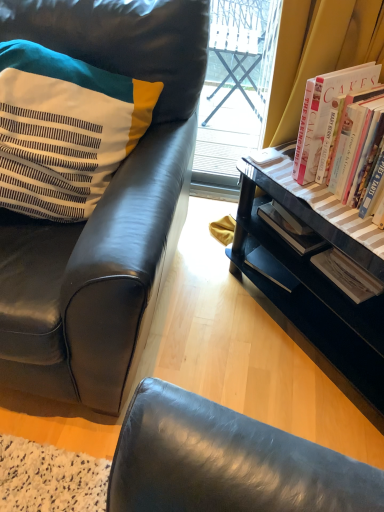
What do you see at coordinates (103, 208) in the screenshot?
I see `black leather chair at left` at bounding box center [103, 208].

Identify the location of striped fabric pillow at left. Image resolution: width=384 pixels, height=512 pixels. (64, 130).

Identify the location of black wood desk at lower right. Image resolution: width=384 pixels, height=512 pixels. (315, 294).

Is black leather chair at left taller than striped fabric pillow at left?

Yes, black leather chair at left is taller than striped fabric pillow at left.

Considering the positions of objects black leather chair at left and striped fabric pillow at left in the image provided, who is behind, black leather chair at left or striped fabric pillow at left?

striped fabric pillow at left is further from the camera.

Can black leather chair at left be found inside black wood desk at lower right?

No.

How different are the orientations of black wood desk at lower right and black leather chair at left in degrees?

46.3 degrees.

From a real-world perspective, which is physically below, black wood desk at lower right or black leather chair at left?

black wood desk at lower right is physically lower.

Is the position of black leather chair at left more distant than that of hardcover books at right?

No, it is not.

From a real-world perspective, does black leather chair at left sit lower than hardcover books at right?

Yes, from a real-world perspective, black leather chair at left is under hardcover books at right.

Consider the image. Would you say hardcover books at right is part of black leather chair at left's contents?

No, black leather chair at left does not contain hardcover books at right.

Is black leather chair at left not close to hardcover books at right?

Actually, black leather chair at left and hardcover books at right are a little close together.

Which is behind, point (46, 179) or point (376, 70)?

The point (376, 70) is behind.

Based on the photo, would you say striped fabric pillow at left is outside hardcover books at right?

Result: Yes, striped fabric pillow at left is not within hardcover books at right.

Consider the image. Does striped fabric pillow at left have a greater height compared to hardcover books at right?

Yes.

I want to click on pillow positioned vertically above the hardcover books at right (from a real-world perspective), so click(x=64, y=130).

Is black leather chair at left inside the boundaries of black wood desk at lower right, or outside?

black leather chair at left is outside black wood desk at lower right.

Considering the positions of objects black leather chair at left and black wood desk at lower right in the image provided, who is more to the left, black leather chair at left or black wood desk at lower right?

black leather chair at left.

Which of these two, black leather chair at left or black wood desk at lower right, is bigger?

black leather chair at left is bigger.

In the image, there is a black leather chair at left. Where is `desk below it (from the image's perspective)`? The width and height of the screenshot is (384, 512). desk below it (from the image's perspective) is located at coordinates 315,294.

Which point is more distant from viewer, (325, 127) or (4, 285)?

The point (325, 127) is farther from the camera.

Locate an element on the screen. The image size is (384, 512). book that is above the black leather chair at left (from a real-world perspective) is located at coordinates (324, 114).

Consider the image. Is the surface of hardcover books at right in direct contact with black leather chair at left?

hardcover books at right is not next to black leather chair at left, and they're not touching.

Between hardcover books at right and black leather chair at left, which one has smaller size?

hardcover books at right.

Is striped fabric pillow at left facing away from black wood desk at lower right?

striped fabric pillow at left does not have its back to black wood desk at lower right.

Based on the photo, considering the sizes of striped fabric pillow at left and black wood desk at lower right in the image, is striped fabric pillow at left wider or thinner than black wood desk at lower right?

Considering their sizes, striped fabric pillow at left looks slimmer than black wood desk at lower right.

Does striped fabric pillow at left come behind black wood desk at lower right?

No, striped fabric pillow at left is closer to the viewer.

From the image's perspective, between striped fabric pillow at left and black wood desk at lower right, which one is located above?

striped fabric pillow at left.

Where is `pillow on the right of black leather chair at left`? The width and height of the screenshot is (384, 512). pillow on the right of black leather chair at left is located at coordinates (64, 130).

I want to click on chair on the left of black wood desk at lower right, so click(103, 208).

From the image, which object appears to be nearer to black wood desk at lower right, black leather chair at left or striped fabric pillow at left?

Based on the image, black leather chair at left appears to be nearer to black wood desk at lower right.

Based on their spatial positions, is hardcover books at right or black wood desk at lower right further from black leather chair at left?

The object further to black leather chair at left is hardcover books at right.

Estimate the real-world distances between objects in this image. Which object is closer to striped fabric pillow at left, hardcover books at right or black wood desk at lower right?

hardcover books at right is positioned closer to the anchor striped fabric pillow at left.

Which object lies further to the anchor point striped fabric pillow at left, black leather chair at left or hardcover books at right?

The object further to striped fabric pillow at left is hardcover books at right.

From the image, which object appears to be farther from striped fabric pillow at left, black wood desk at lower right or hardcover books at right?

black wood desk at lower right lies further to striped fabric pillow at left than the other object.

Considering their positions, is black leather chair at left positioned further to striped fabric pillow at left than black wood desk at lower right?

black wood desk at lower right lies further to striped fabric pillow at left than the other object.

Considering their positions, is striped fabric pillow at left positioned further to hardcover books at right than black wood desk at lower right?

striped fabric pillow at left is positioned further to the anchor hardcover books at right.

Consider the image. Estimate the real-world distances between objects in this image. Which object is closer to striped fabric pillow at left, black wood desk at lower right or black leather chair at left?

black leather chair at left.

At what (x,y) coordinates should I click in order to perform the action: click on pillow between black leather chair at left and black wood desk at lower right from left to right. Please return your answer as a coordinate pair (x, y). The height and width of the screenshot is (512, 384). Looking at the image, I should click on (64, 130).

The height and width of the screenshot is (512, 384). Find the location of `desk situated between striped fabric pillow at left and hardcover books at right from left to right`. desk situated between striped fabric pillow at left and hardcover books at right from left to right is located at coordinates (315, 294).

Find the location of a particular element. This screenshot has width=384, height=512. pillow between black leather chair at left and hardcover books at right in the horizontal direction is located at coordinates (64, 130).

The image size is (384, 512). Identify the location of desk situated between black leather chair at left and hardcover books at right from left to right. (315, 294).